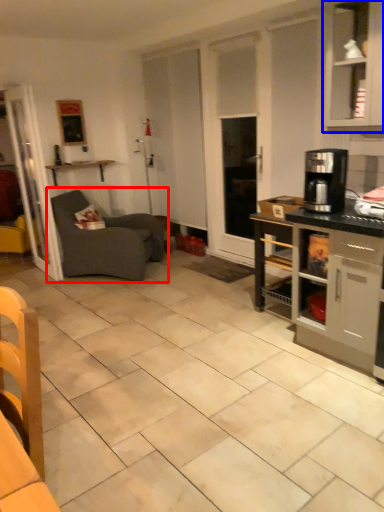
Question: Which point is further to the camera, studio couch (highlighted by a red box) or cabinetry (highlighted by a blue box)?

Choices:
 (A) studio couch
 (B) cabinetry

Answer: (A)